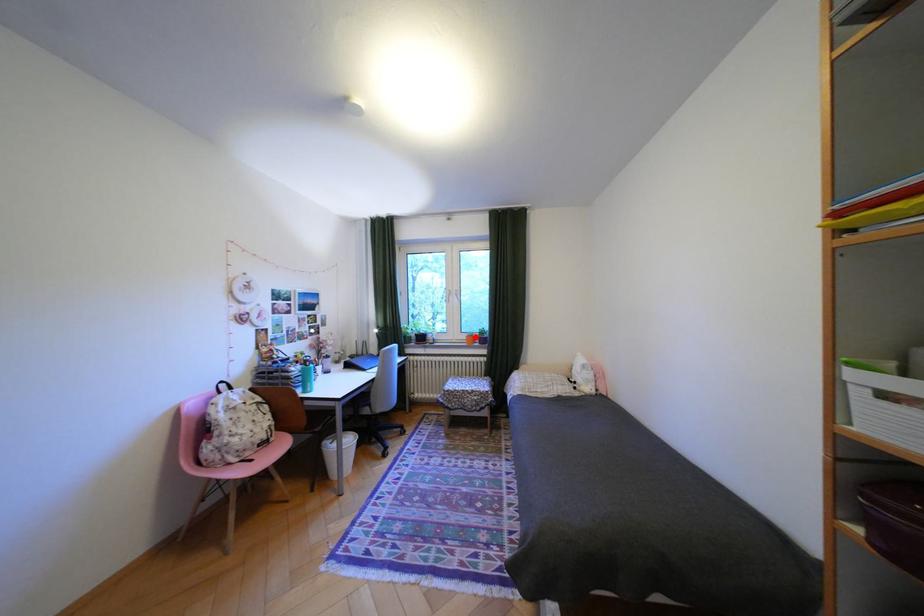
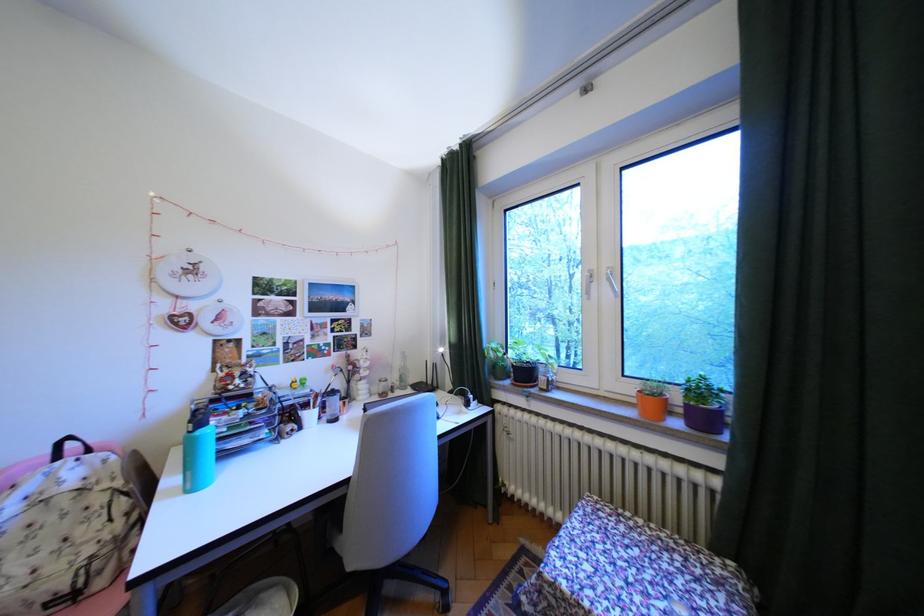
Locate, in the second image, the point that corresponds to the highlighted location in the first image.

(641, 390)